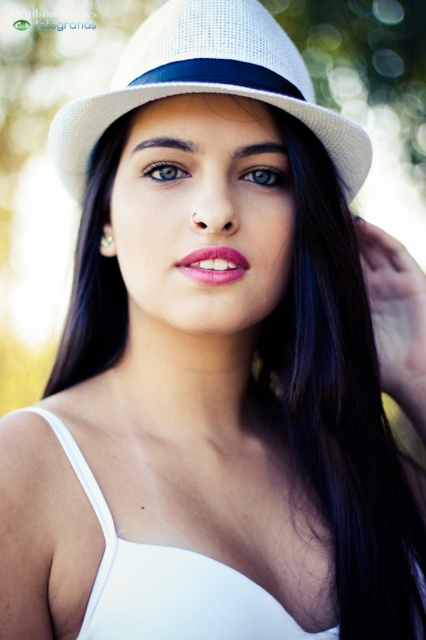
What is located at the coordinates point (207, 83) in the image?

The white woven fedora at upper center is located at point (207, 83).

You are a fashion designer preparing for a photoshoot. You need to adjust the lighting to ensure the white woven fedora at upper center and the white fabric dress at center are both well illuminated. Given their current distance apart, can you estimate if the lighting setup will require separate adjustments for each item to avoid shadows?

The distance between the white woven fedora at upper center and the white fabric dress at center is 42.52 centimeters. Since they are separated by this distance, the lighting setup may require separate adjustments to ensure both items are well illuminated without casting unwanted shadows on each other.

You are taking a photo of a person wearing a white hat with a dark band and a white sleeveless top. You notice two points in the image at coordinates point (261, 170) and point (152, 166). Which point is closer to the camera?

Point (152, 166) is closer to the camera than point (261, 170).